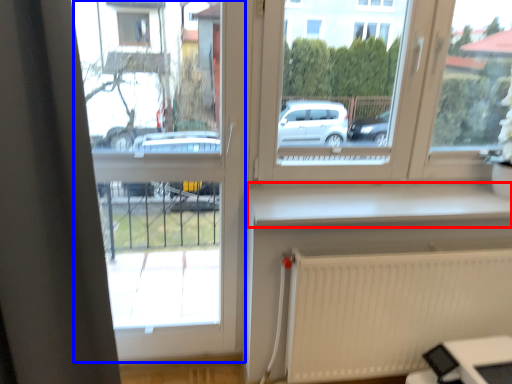
Question: Which object appears closest to the camera in this image, window sill (highlighted by a red box) or window frame (highlighted by a blue box)?

Choices:
 (A) window sill
 (B) window frame

Answer: (B)